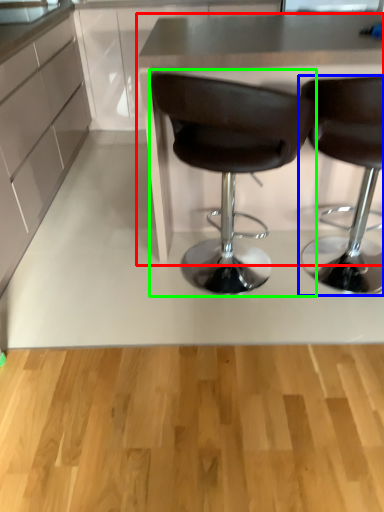
Question: Based on their relative distances, which object is farther from table (highlighted by a red box)? Choose from chair (highlighted by a blue box) and chair (highlighted by a green box).

Choices:
 (A) chair
 (B) chair

Answer: (A)